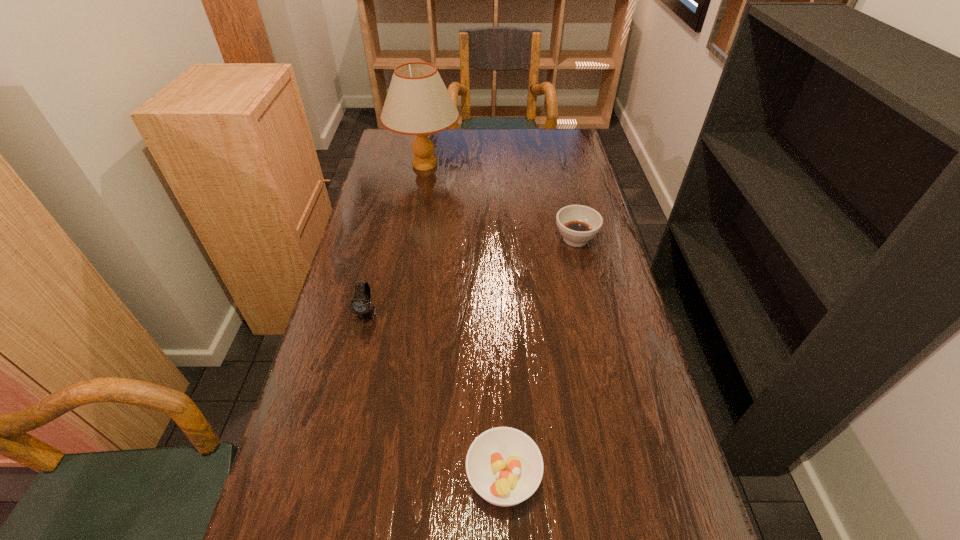
What are the coordinates of `the farthest object` in the screenshot? It's located at (418, 103).

Locate an element on the screen. This screenshot has height=540, width=960. lampshade is located at coordinates (418, 103).

At what (x,y) coordinates should I click in order to perform the action: click on the second tallest object. Please return your answer as a coordinate pair (x, y). This screenshot has width=960, height=540. Looking at the image, I should click on (360, 304).

Identify the location of the third farthest object. (360, 304).

Where is `the right soup bowl`? The width and height of the screenshot is (960, 540). the right soup bowl is located at coordinates (578, 224).

The width and height of the screenshot is (960, 540). Find the location of `the second farthest object`. the second farthest object is located at coordinates (578, 224).

Image resolution: width=960 pixels, height=540 pixels. In order to click on the third object from left to right in this screenshot , I will do click(504, 465).

The height and width of the screenshot is (540, 960). Find the location of `the shortest object`. the shortest object is located at coordinates (504, 465).

Find the location of a particular element. This screenshot has height=540, width=960. vacant space located 0.200m on the right of the tallest object is located at coordinates (516, 165).

Where is `vacant space located on the face of the third shortest object`? vacant space located on the face of the third shortest object is located at coordinates pos(346,406).